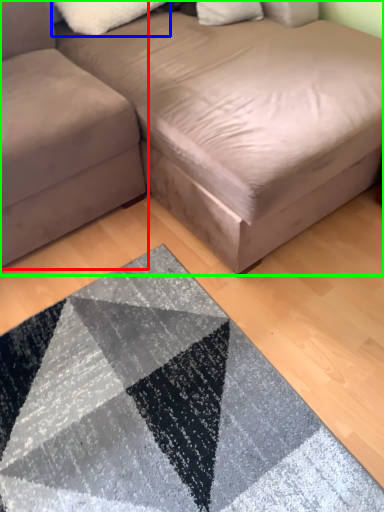
Question: Which object is positioned farthest from studio couch (highlighted by a red box)? Select from pillow (highlighted by a blue box) and studio couch (highlighted by a green box).

Choices:
 (A) pillow
 (B) studio couch

Answer: (A)